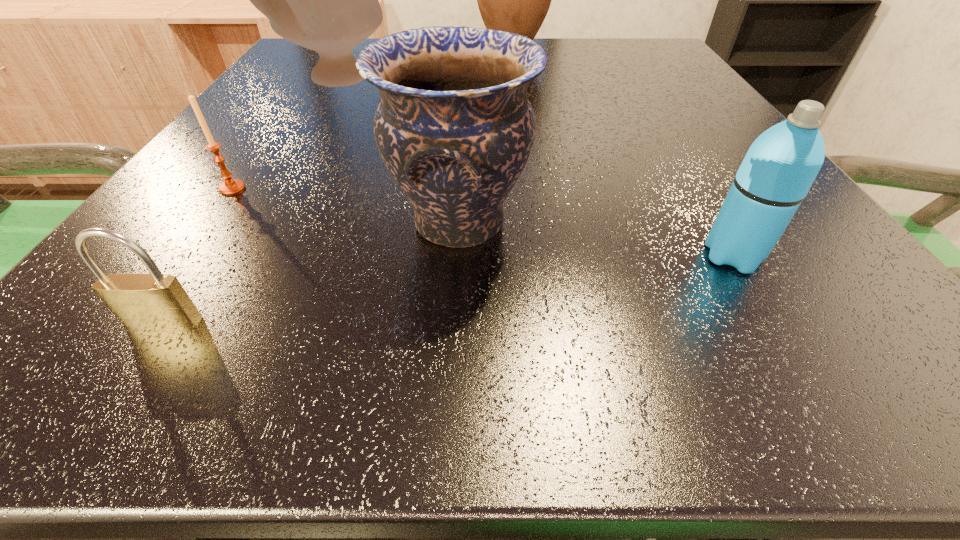
The width and height of the screenshot is (960, 540). In order to click on pitcher in this screenshot , I will do `click(516, 0)`.

This screenshot has width=960, height=540. Identify the location of the farther pottery. (326, 0).

The height and width of the screenshot is (540, 960). In order to click on the left pottery in this screenshot , I will do 326,0.

The image size is (960, 540). Find the location of `the shorter pottery`. the shorter pottery is located at coordinates (454, 127).

At what (x,y) coordinates should I click in order to perform the action: click on the nearer pottery. Please return your answer as a coordinate pair (x, y). The width and height of the screenshot is (960, 540). Looking at the image, I should click on (454, 127).

Locate an element on the screen. The height and width of the screenshot is (540, 960). thermos bottle is located at coordinates (781, 165).

The width and height of the screenshot is (960, 540). I want to click on candle_holder, so click(x=231, y=186).

Locate an element on the screen. Image resolution: width=960 pixels, height=540 pixels. padlock is located at coordinates (153, 301).

Where is `blank space located 0.380m on the front of the pitcher`? Image resolution: width=960 pixels, height=540 pixels. blank space located 0.380m on the front of the pitcher is located at coordinates (528, 162).

Find the location of a particular element. The height and width of the screenshot is (540, 960). vacant space situated on the front of the left pottery is located at coordinates (309, 127).